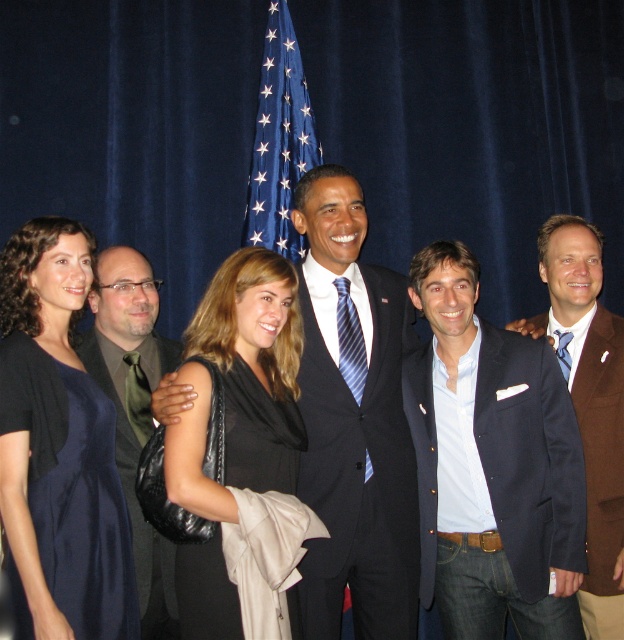
You are a photographer adjusting the lighting for the group photo. You notice the green satin tie at left and the blue fabric flag at upper center. Which object is closer to the camera?

The blue fabric flag at upper center is closer to the camera because the green satin tie at left is positioned under it, meaning the flag is above and closer.